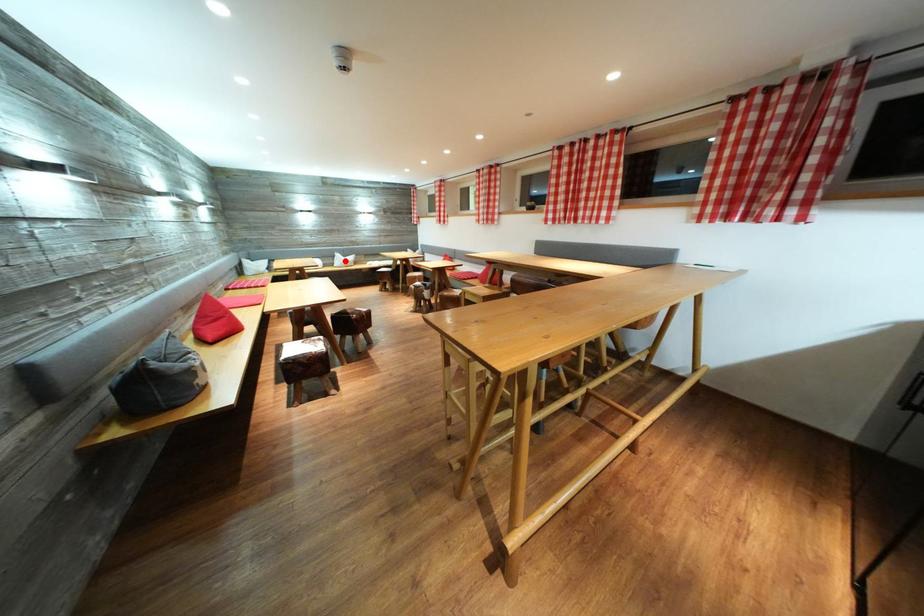
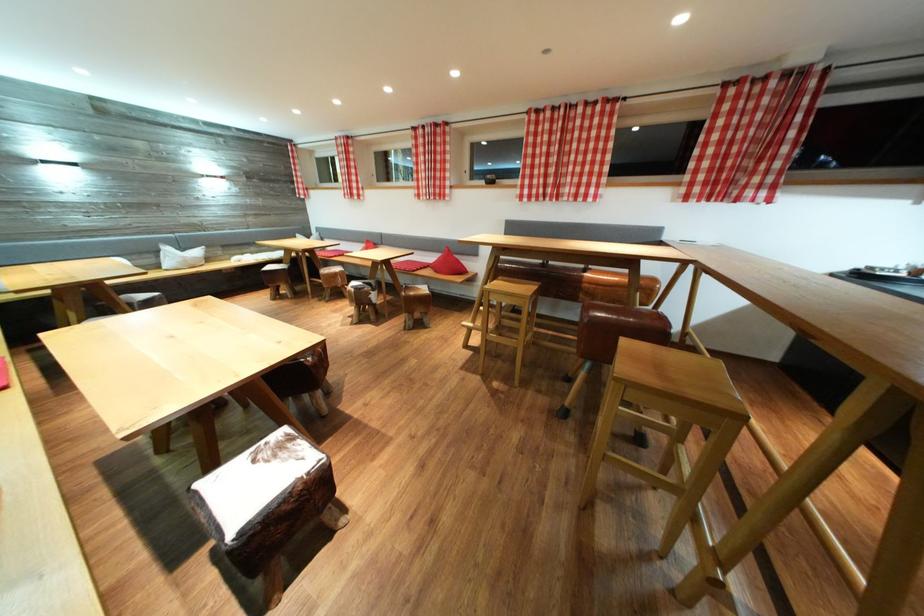
Question: I am providing you with two images of the same scene from different viewpoints. Image1 has a red point marked. In image2, the corresponding 3D location appears at what relative position? Reply with the corresponding letter.

Choices:
 (A) Closer
 (B) Farther

Answer: (B)